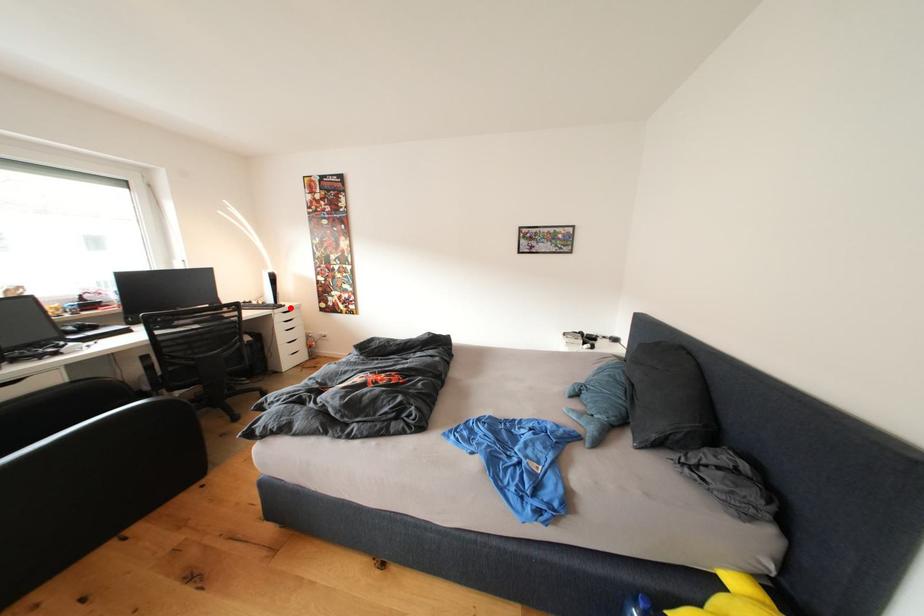
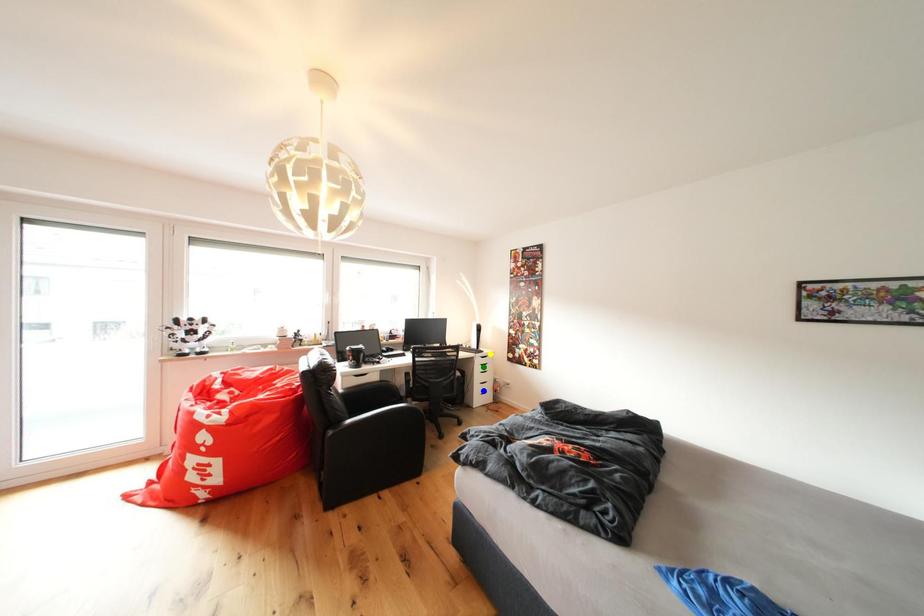
Question: I am providing you with two images of the same scene from different viewpoints. A red point is marked on the first image. You are given multiple points on the second image. Which mark in image 2 goes with the point in image 1?

Choices:
 (A) blue point
 (B) yellow point
 (C) green point

Answer: (B)